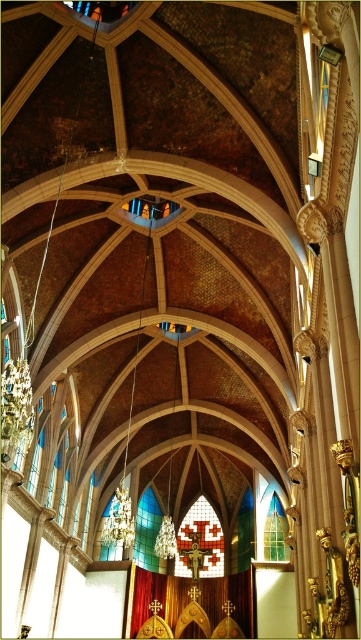
You are standing inside the grand church and want to take a closer look at the translucent stained glass at center. If you walk straight ahead, will you be able to reach it within 10 meters?

The translucent stained glass at center is 119.63 meters away from viewer, so walking straight ahead will not allow you to reach it within 10 meters as the distance is much greater.

You are standing inside the church and notice two stained glass artworks. One is the multicolored stained glass at center and the other is the stained glass window at center. Which one appears closer to you?

The multicolored stained glass at center appears closer to you because it is further to the viewer than the stained glass window at center.

You are an architect examining the church interior. You notice two stained glass elements at the center area. Which one is wider, the translucent stained glass at center or the stained glass window at center?

The translucent stained glass at center might be wider than the stained glass window at center according to the description.